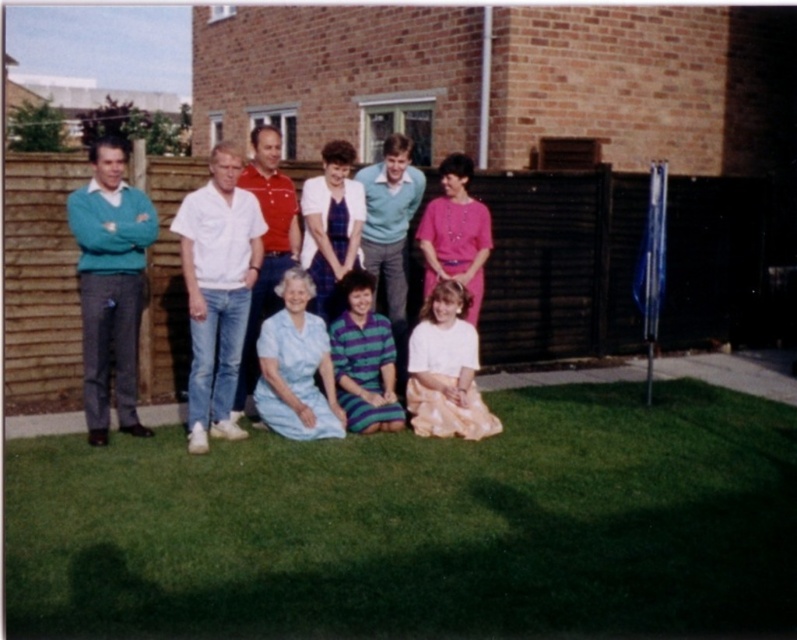
You are a photographer taking a group photo of the matte blue dress at center and the teal knit sweater at left. Which person should you ask to stand on a stool to ensure both are at the same height in the photo?

The teal knit sweater at left should stand on a stool because the matte blue dress at center is much taller, so elevating the shorter person will balance their heights in the photo.

You are standing in the backyard and want to place a small potted plant between the green grass at lower center and the teal knit sweater at left. Based on their widths, which object should the plant be closer to?

The green grass at lower center might be wider than teal knit sweater at left, so the plant should be placed closer to the teal knit sweater at left to ensure it fits within the available space.